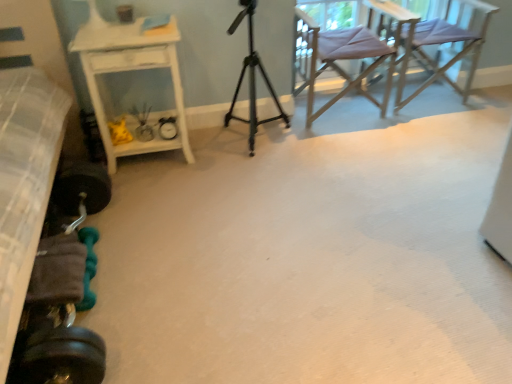
Question: Looking at their shapes, would you say white glossy side table at left is wider or thinner than textured gray bed at left?

Choices:
 (A) thin
 (B) wide

Answer: (A)

Question: From the image's perspective, is white glossy side table at left located above or below textured gray bed at left?

Choices:
 (A) above
 (B) below

Answer: (A)

Question: Estimate the real-world distances between objects in this image. Which object is farther from the white glossy side table at left?

Choices:
 (A) light purple fabric chair at upper right, marked as the second chair in a left-to-right arrangement
 (B) metallic tripod at center
 (C) textured gray bed at left
 (D) purple fabric chair at upper right, which appears as the second chair when viewed from the right

Answer: (A)

Question: Which object is the farthest from the light purple fabric chair at upper right, the 1th chair when ordered from right to left?

Choices:
 (A) white glossy side table at left
 (B) metallic tripod at center
 (C) purple fabric chair at upper right, the first chair viewed from the left
 (D) textured gray bed at left

Answer: (D)